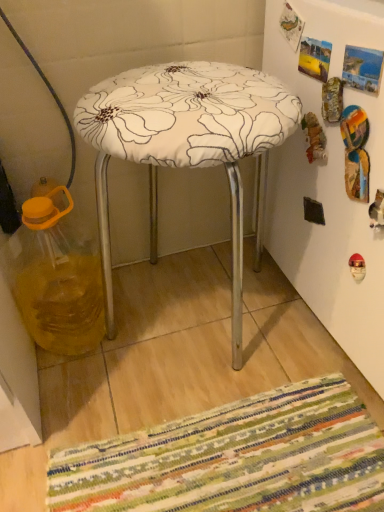
Identify the location of translucent yellow liquid at left. The height and width of the screenshot is (512, 384). (55, 279).

What is the approximate height of translucent yellow liquid at left?

translucent yellow liquid at left is 13.14 inches in height.

Describe the element at coordinates (55, 279) in the screenshot. The image size is (384, 512). I see `translucent yellow liquid at left` at that location.

In order to face white fabric-covered stool at center, should I rotate leftwards or rightwards?

Rotate left and turn 0.657 degrees.

Image resolution: width=384 pixels, height=512 pixels. What do you see at coordinates (187, 143) in the screenshot?
I see `white fabric-covered stool at center` at bounding box center [187, 143].

Where is `white fabric-covered stool at center`? white fabric-covered stool at center is located at coordinates (187, 143).

Image resolution: width=384 pixels, height=512 pixels. In order to click on translucent yellow liquid at left in this screenshot , I will do `click(55, 279)`.

Is white fabric-covered stool at center to the left of translucent yellow liquid at left from the viewer's perspective?

No, white fabric-covered stool at center is not to the left of translucent yellow liquid at left.

Which is behind, white fabric-covered stool at center or translucent yellow liquid at left?

Positioned behind is translucent yellow liquid at left.

Is point (148, 123) positioned behind point (35, 282)?

No, (148, 123) is closer to viewer.

From the image's perspective, does white fabric-covered stool at center appear higher than translucent yellow liquid at left?

Yes, from the image's perspective, white fabric-covered stool at center is over translucent yellow liquid at left.

From a real-world perspective, which is physically above, white fabric-covered stool at center or translucent yellow liquid at left?

white fabric-covered stool at center, from a real-world perspective.

Which object is wider, white fabric-covered stool at center or translucent yellow liquid at left?

white fabric-covered stool at center.

Between white fabric-covered stool at center and translucent yellow liquid at left, which one has more height?

With more height is white fabric-covered stool at center.

Between white fabric-covered stool at center and translucent yellow liquid at left, which one has larger size?

With larger size is white fabric-covered stool at center.

Is white fabric-covered stool at center situated inside translucent yellow liquid at left or outside?

white fabric-covered stool at center is spatially situated outside translucent yellow liquid at left.

Is white fabric-covered stool at center directly adjacent to translucent yellow liquid at left?

They are not placed beside each other.

Is white fabric-covered stool at center oriented towards translucent yellow liquid at left?

No, white fabric-covered stool at center is not aimed at translucent yellow liquid at left.

What's the angular difference between white fabric-covered stool at center and translucent yellow liquid at left's facing directions?

2.3 degrees.

Find the location of `stool above the translucent yellow liquid at left (from a real-world perspective)`. stool above the translucent yellow liquid at left (from a real-world perspective) is located at coordinates (187, 143).

Can you confirm if translucent yellow liquid at left is positioned to the left of white fabric-covered stool at center?

Correct, you'll find translucent yellow liquid at left to the left of white fabric-covered stool at center.

Who is more distant, translucent yellow liquid at left or white fabric-covered stool at center?

translucent yellow liquid at left.

Which point is more distant from viewer, [88,344] or [202,135]?

The point [88,344] is farther.

From the image's perspective, relative to white fabric-covered stool at center, is translucent yellow liquid at left above or below?

translucent yellow liquid at left is situated lower than white fabric-covered stool at center in the image.

In the scene shown: From a real-world perspective, who is located higher, translucent yellow liquid at left or white fabric-covered stool at center?

From a 3D spatial view, white fabric-covered stool at center is above.

Looking at their sizes, would you say translucent yellow liquid at left is wider or thinner than white fabric-covered stool at center?

Clearly, translucent yellow liquid at left has less width compared to white fabric-covered stool at center.

Considering the sizes of objects translucent yellow liquid at left and white fabric-covered stool at center in the image provided, who is shorter, translucent yellow liquid at left or white fabric-covered stool at center?

translucent yellow liquid at left.

Is translucent yellow liquid at left bigger than white fabric-covered stool at center?

Incorrect, translucent yellow liquid at left is not larger than white fabric-covered stool at center.

Can we say translucent yellow liquid at left lies outside white fabric-covered stool at center?

Yes.

Is translucent yellow liquid at left not close to white fabric-covered stool at center?

That's not correct — translucent yellow liquid at left is a little close to white fabric-covered stool at center.

Is translucent yellow liquid at left oriented towards white fabric-covered stool at center?

No, translucent yellow liquid at left is not aimed at white fabric-covered stool at center.

What's the angular difference between translucent yellow liquid at left and white fabric-covered stool at center's facing directions?

The angle between the facing direction of translucent yellow liquid at left and the facing direction of white fabric-covered stool at center is 2.3 degrees.

How distant is translucent yellow liquid at left from white fabric-covered stool at center?

The distance of translucent yellow liquid at left from white fabric-covered stool at center is 15.54 inches.

Find the location of a particular element. The width and height of the screenshot is (384, 512). stool in front of the translucent yellow liquid at left is located at coordinates (187, 143).

Locate an element on the screen. The width and height of the screenshot is (384, 512). stool in front of the translucent yellow liquid at left is located at coordinates (187, 143).

Where is `glass jar lying behind the white fabric-covered stool at center`? Image resolution: width=384 pixels, height=512 pixels. glass jar lying behind the white fabric-covered stool at center is located at coordinates (55, 279).